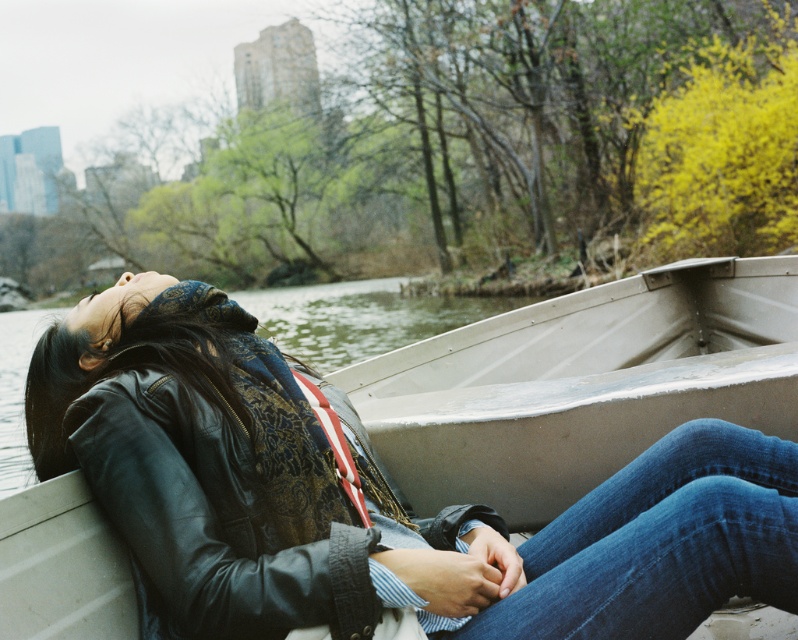
Question: Which object is the closest to the denim at center?

Choices:
 (A) metallic gray canoe at center
 (B) leather jacket at center

Answer: (A)

Question: Among these points, which one is farthest from the camera?

Choices:
 (A) (354, 534)
 (B) (650, 531)
 (C) (532, 472)
 (D) (133, 557)

Answer: (C)

Question: Can you confirm if leather jacket at center is positioned below denim at center?

Choices:
 (A) yes
 (B) no

Answer: (B)

Question: Which of the following is the closest to the observer?

Choices:
 (A) (618, 429)
 (B) (793, 467)

Answer: (B)

Question: Does leather jacket at center have a larger size compared to denim at center?

Choices:
 (A) yes
 (B) no

Answer: (A)

Question: Can you confirm if metallic gray canoe at center is bigger than denim at center?

Choices:
 (A) no
 (B) yes

Answer: (B)